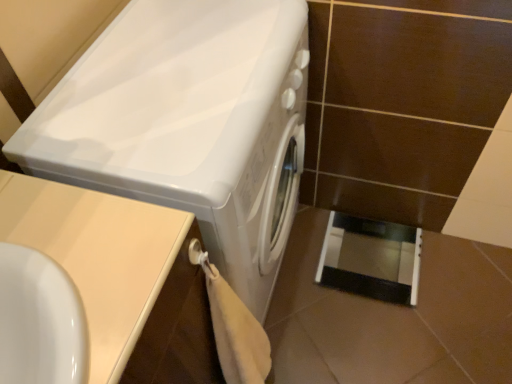
What are the coordinates of `vacant area located to the right-hand side of black glossy screen door at lower right` in the screenshot? It's located at coord(460,273).